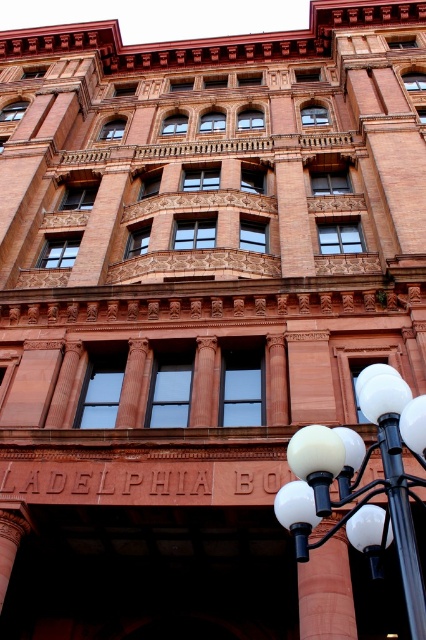
Can you confirm if white glass street light at lower right is bigger than black metal pole at lower right?

Yes.

Can you confirm if white glass street light at lower right is positioned to the left of black metal pole at lower right?

Yes, white glass street light at lower right is to the left of black metal pole at lower right.

The height and width of the screenshot is (640, 426). What are the coordinates of `white glass street light at lower right` in the screenshot? It's located at (365, 484).